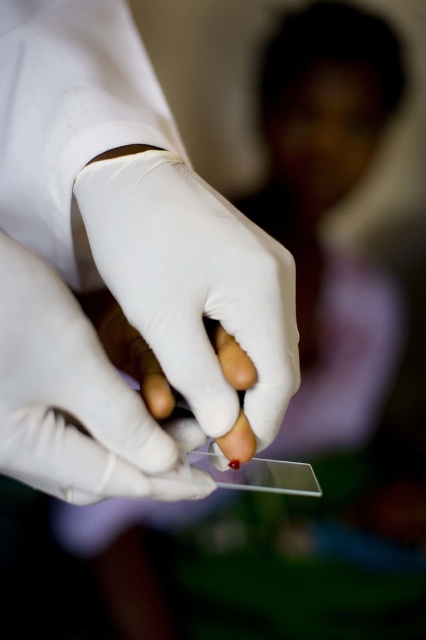
Question: Which of the following is the farthest from the observer?

Choices:
 (A) white matte glove at center
 (B) transparent glass slide at center

Answer: (A)

Question: Is transparent glass slide at center to the right of white matte glove at center from the viewer's perspective?

Choices:
 (A) no
 (B) yes

Answer: (A)

Question: Which object is farther from the camera taking this photo?

Choices:
 (A) white matte gloves at center
 (B) white matte glove at center

Answer: (B)

Question: Among these objects, which one is nearest to the camera?

Choices:
 (A) white matte gloves at center
 (B) white matte glove at center

Answer: (A)

Question: Is white smooth glove at center closer to camera compared to white matte gloves at center?

Choices:
 (A) no
 (B) yes

Answer: (A)

Question: Where is transparent glass slide at center located in relation to white matte gloves at center in the image?

Choices:
 (A) above
 (B) below

Answer: (A)